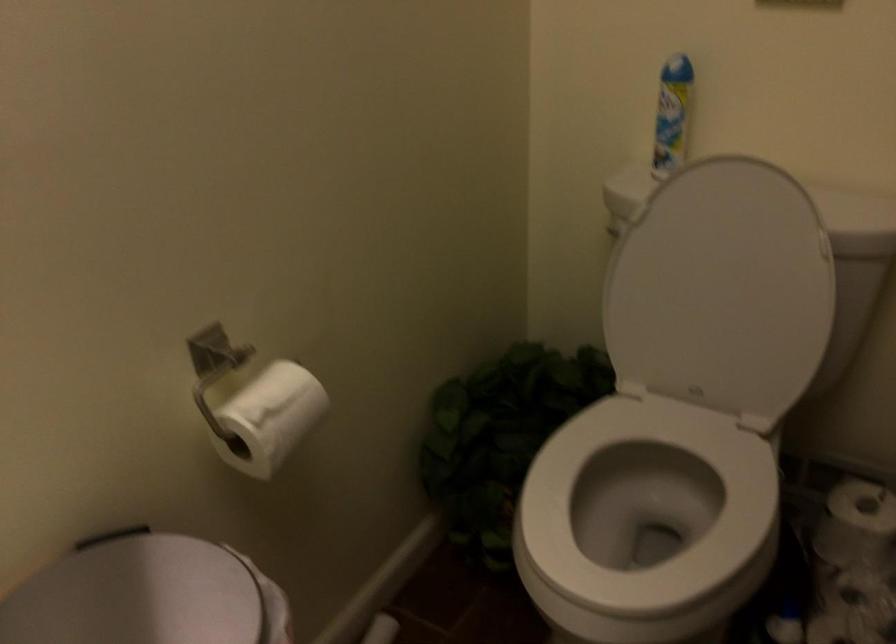
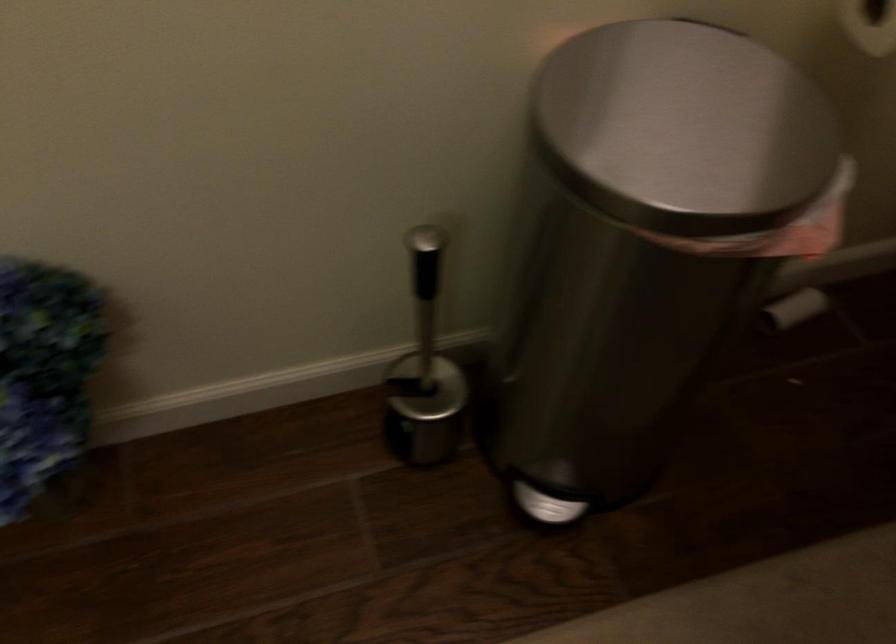
The first image is from the beginning of the video and the second image is from the end. How did the camera likely rotate when shooting the video?

The camera's rotation is toward left-down.